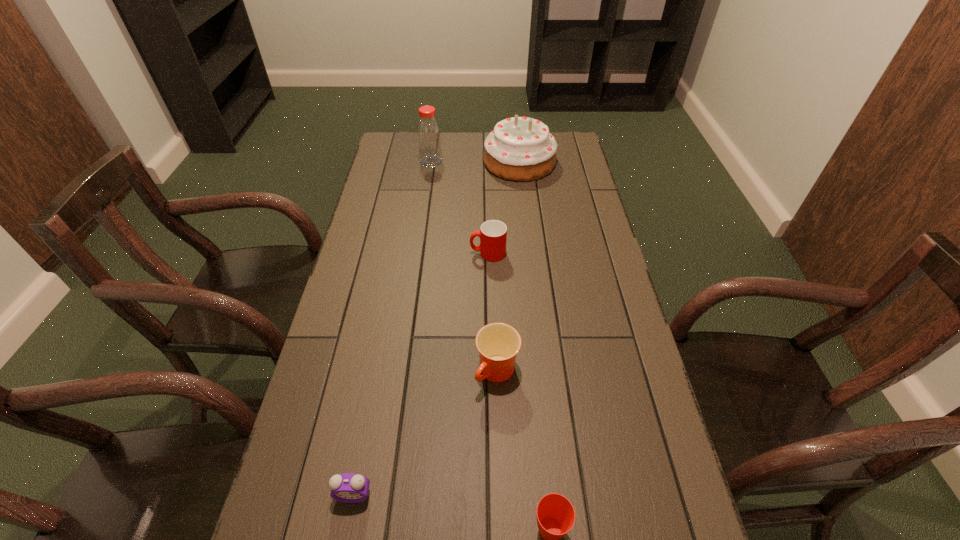
The height and width of the screenshot is (540, 960). Find the location of `free point located on the side of the fourth nearest object with the handle`. free point located on the side of the fourth nearest object with the handle is located at coordinates tap(368, 253).

Find the location of a particular element. free location located 0.110m on the side of the fourth nearest object with the handle is located at coordinates point(436,253).

Locate an element on the screen. bottle located in the far edge section of the desktop is located at coordinates (428, 130).

You are a GUI agent. You are given a task and a screenshot of the screen. Output one action in this format:
    pyautogui.click(x=<x>, y=<y>)
    Task: Click on the cake at the far edge
    
    Given the screenshot: What is the action you would take?
    pyautogui.click(x=519, y=148)

What are the coordinates of `object that is at the left edge` in the screenshot? It's located at (350, 488).

This screenshot has height=540, width=960. I want to click on object at the right edge, so click(519, 148).

You are a GUI agent. You are given a task and a screenshot of the screen. Output one action in this format:
    pyautogui.click(x=<x>, y=<y>)
    Task: Click on the object present at the far right corner
    This screenshot has height=540, width=960.
    Given the screenshot: What is the action you would take?
    pyautogui.click(x=519, y=148)

In the image, there is a desktop. Where is `free region at the left edge`? This screenshot has height=540, width=960. free region at the left edge is located at coordinates (402, 170).

Identify the location of vacant space at the right edge of the desktop. This screenshot has width=960, height=540. (580, 307).

Where is `vacant space at the far left corner of the desktop`? Image resolution: width=960 pixels, height=540 pixels. vacant space at the far left corner of the desktop is located at coordinates (380, 155).